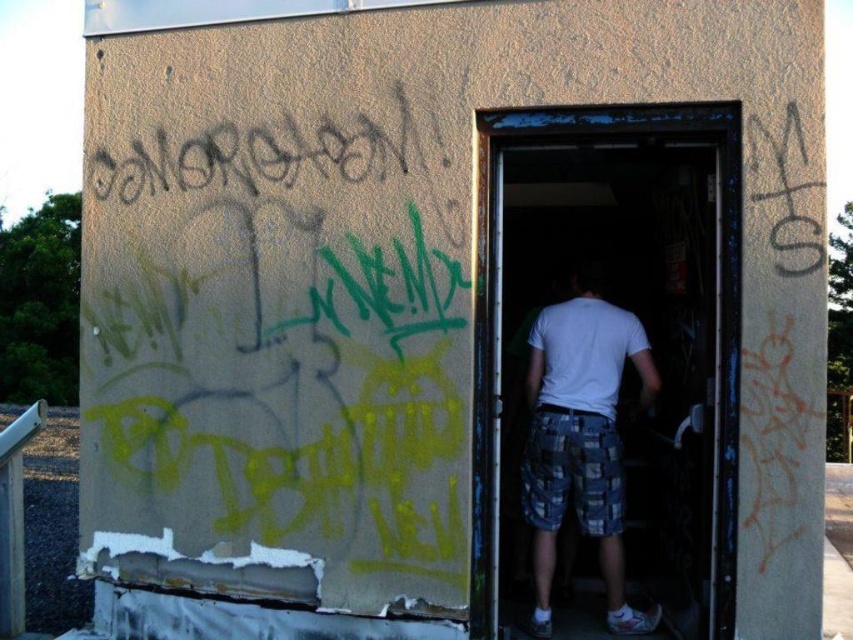
You are standing outside the weathered building with graffiti on its concrete wall. You see a point at coordinates (x=606, y=371). What object is located at this point?

The point at coordinates (x=606, y=371) corresponds to the wooden door at center.

You are standing at the entrance of the building and want to move towards the interior. There are two points marked on the wall at coordinates point (x=656, y=496) and point (x=554, y=556). Which point will you encounter first as you move forward into the building?

Point (x=554, y=556) will be encountered first because it is in front of point (x=656, y=496) according to their spatial relationship.